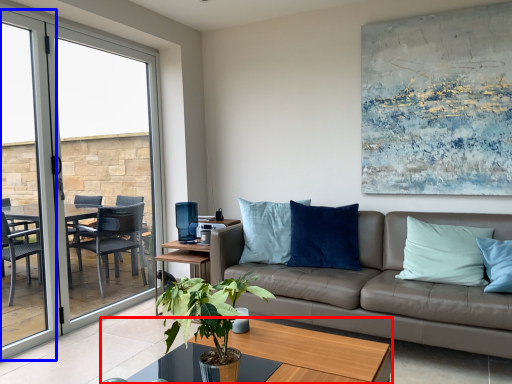
Question: Which point is further to the camera, coffee table (highlighted by a red box) or screen door (highlighted by a blue box)?

Choices:
 (A) coffee table
 (B) screen door

Answer: (B)